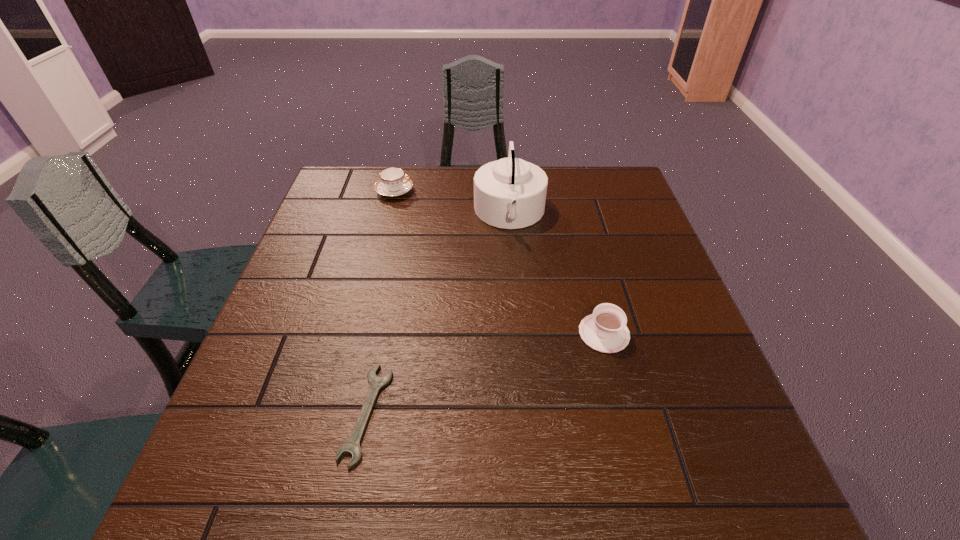
Locate an element on the screen. Image resolution: width=960 pixels, height=540 pixels. object situated at the far left corner is located at coordinates (393, 182).

Where is `vacant region at the far edge of the desktop`? vacant region at the far edge of the desktop is located at coordinates (454, 204).

I want to click on vacant space at the near edge, so click(x=302, y=465).

Find the location of a particular element. free space at the left edge of the desktop is located at coordinates (301, 442).

Locate an element on the screen. The height and width of the screenshot is (540, 960). free spot at the right edge of the desktop is located at coordinates (628, 217).

Identify the location of vacant space at the far left corner of the desktop. This screenshot has width=960, height=540. (376, 173).

Identify the location of vacant area that lies between the second nearest object and the tallest object. (557, 273).

Locate an element on the screen. This screenshot has height=540, width=960. free space that is in between the farther teacup and the third object from left to right is located at coordinates (452, 202).

Where is `free space between the left teacup and the right teacup`? The width and height of the screenshot is (960, 540). free space between the left teacup and the right teacup is located at coordinates (499, 262).

The width and height of the screenshot is (960, 540). What are the coordinates of `free space between the third object from left to right and the second nearest object` in the screenshot? It's located at (557, 273).